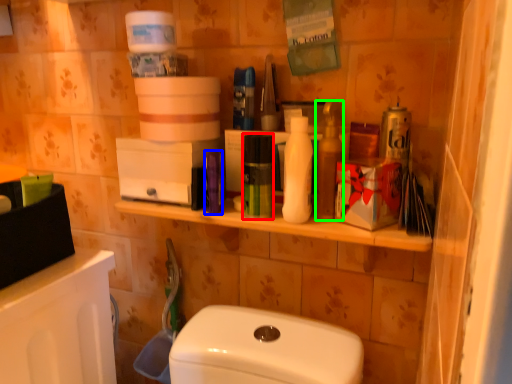
Question: Which object is positioned farthest from mouthwash (highlighted by a red box)? Select from toiletry (highlighted by a blue box) and cleaning product (highlighted by a green box).

Choices:
 (A) toiletry
 (B) cleaning product

Answer: (B)